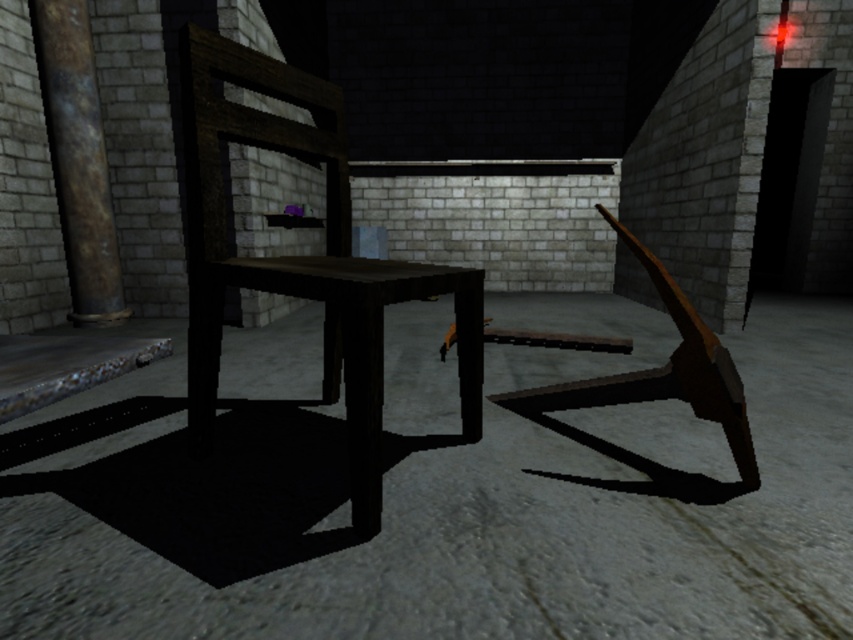
In the scene shown: You are a game character needing to sit down. You see a wooden chair at center and a rusty metal pillar at left. Which object can you sit on?

The wooden chair at center is bigger than the rusty metal pillar at left, so you can sit on the wooden chair at center.

You are a character in a game needing to move from the wooden chair at center to the rusty metal pillar at left. The game requires you to jump over a gap of at least 6 feet. Can you make the jump?

Answer: The distance between the wooden chair at center and the rusty metal pillar at left is 6.84 feet, which is longer than the required 6 feet. Therefore, you can make the jump over the gap.

You are a character in a game who needs to move closer to the wooden chair at center to interact with it. The game requires you to be within 1 meter to activate an interaction. Can you activate the interaction from your current position?

The wooden chair at center is 93.66 centimeters from camera. Since 93.66 cm is less than 1 meter, you can activate the interaction from your current position.